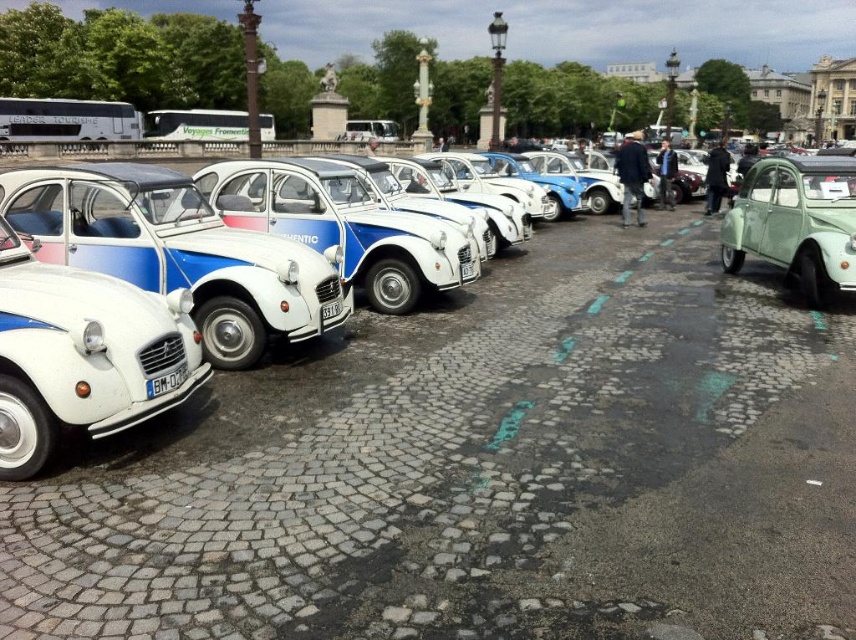
You are standing on the cobblestone street and want to walk from the point at coordinates point (x=61, y=472) to the point at coordinates point (x=58, y=419). Which direction should you face to move towards your destination?

You should face away from the viewer because point (x=61, y=472) is further to the viewer than point (x=58, y=419), so moving away from the viewer will take you towards the destination.

You are a delivery person trying to park a new white matte car at center between two parked cars on a narrow cobblestone street. The car to your left is a white matte vintage car at left. Considering the width of the cars, can you safely maneuver the new car into the space without touching the vintage car?

The white matte car at center is wider than the white matte vintage car at left, so maneuvering it between them might be challenging. However, since the vintage car is narrower, there might be enough space if aligned properly. Check the exact measurements before proceeding.